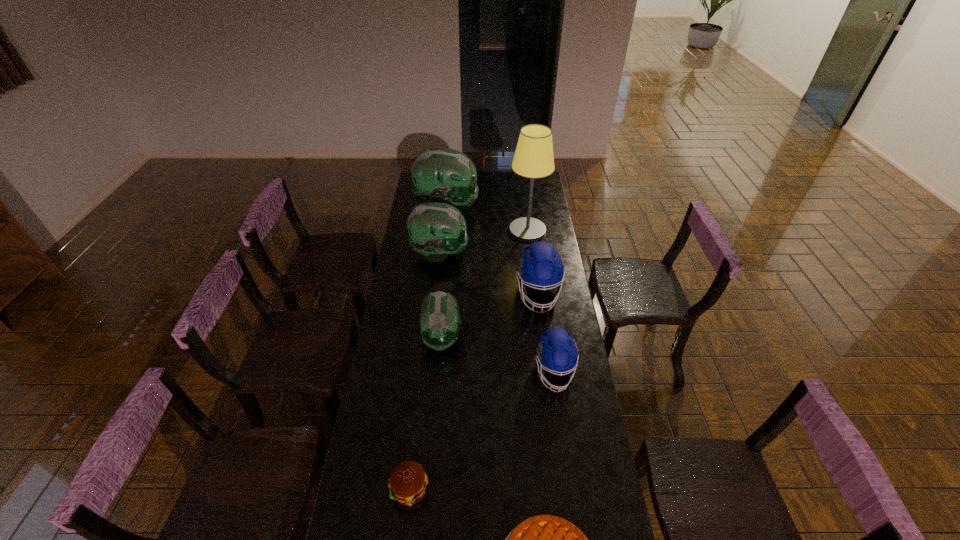
At what (x,y) coordinates should I click in order to perform the action: click on free space between the seventh farthest object and the bigger blue football helmet. Please return your answer as a coordinate pair (x, y). The width and height of the screenshot is (960, 540). Looking at the image, I should click on (474, 392).

The height and width of the screenshot is (540, 960). What are the coordinates of `free space between the second nearest green football helmet and the third nearest football helmet` in the screenshot? It's located at (489, 274).

Identify which object is the fourth closest to the hamburger. Please provide its 2D coordinates. Your answer should be formatted as a tuple, i.e. [(x, y)], where the tuple contains the x and y coordinates of a point satisfying the conditions above.

[(540, 265)]

Choose which object is the second nearest neighbor to the second farthest football helmet. Please provide its 2D coordinates. Your answer should be formatted as a tuple, i.e. [(x, y)], where the tuple contains the x and y coordinates of a point satisfying the conditions above.

[(533, 158)]

Locate an element on the screen. The height and width of the screenshot is (540, 960). football helmet that stands as the closest to the pie is located at coordinates (556, 350).

Identify which football helmet is the fourth nearest to the smaller blue football helmet. Please provide its 2D coordinates. Your answer should be formatted as a tuple, i.e. [(x, y)], where the tuple contains the x and y coordinates of a point satisfying the conditions above.

[(443, 175)]

Select which green football helmet appears as the closest to the seventh shortest object. Please provide its 2D coordinates. Your answer should be formatted as a tuple, i.e. [(x, y)], where the tuple contains the x and y coordinates of a point satisfying the conditions above.

[(435, 230)]

Where is `the third closest green football helmet relative to the seventh tallest object`? Image resolution: width=960 pixels, height=540 pixels. the third closest green football helmet relative to the seventh tallest object is located at coordinates (443, 175).

The height and width of the screenshot is (540, 960). I want to click on vacant area that satisfies the following two spatial constraints: 1. on the visor of the biggest green football helmet; 2. on the right side of the table lamp, so click(x=444, y=231).

Where is `free region that satisfies the following two spatial constraints: 1. on the front side of the tallest object; 2. on the visor of the fourth nearest football helmet`? The height and width of the screenshot is (540, 960). free region that satisfies the following two spatial constraints: 1. on the front side of the tallest object; 2. on the visor of the fourth nearest football helmet is located at coordinates tap(531, 254).